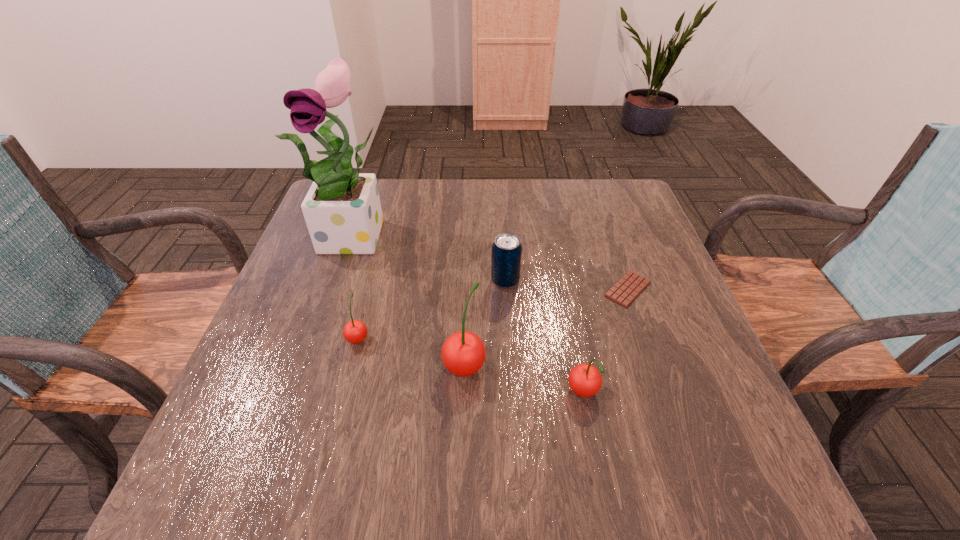
Given the evenly spaced cherrys in the image, where should an extra cherry be added on the right to preserve the spacing? Please point to a vacant space. Please provide its 2D coordinates. Your answer should be formatted as a tuple, i.e. [(x, y)], where the tuple contains the x and y coordinates of a point satisfying the conditions above.

[(717, 428)]